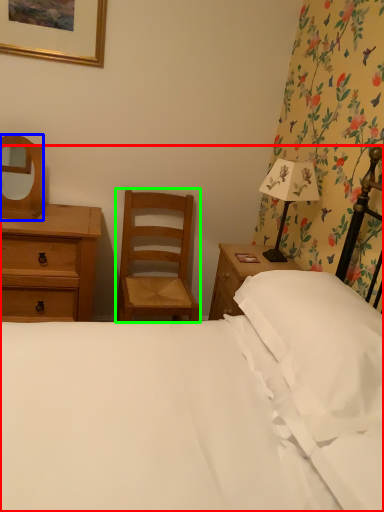
Question: Estimate the real-world distances between objects in this image. Which object is farther from bed (highlighted by a red box), mirror (highlighted by a blue box) or chair (highlighted by a green box)?

Choices:
 (A) mirror
 (B) chair

Answer: (A)